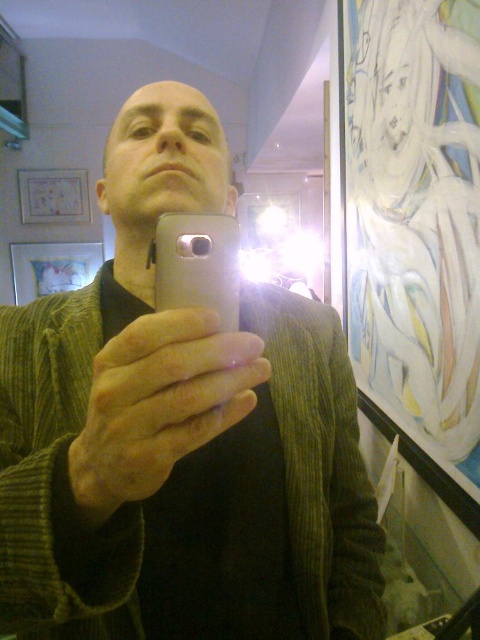
You are trying to take a clear selfie in the dimly lit room. You have two phones available, the matte silver phone at center and the silver metallic phone at center. Which phone should you choose to minimize glare from the bright light source?

The matte silver phone at center is located below the silver metallic phone at center. Since matte surfaces typically reflect less light and glare compared to shiny metallic surfaces, the matte silver phone at center would be better to minimize glare.

You are a photographer trying to capture a clear shot of the matte silver phone at center and the silver metallic phone at center in the scene. Since there is a glare from the bright light source, which phone might be more challenging to photograph due to its reflective surface?

The silver metallic phone at center has a more reflective surface compared to the matte silver phone at center, making it harder to photograph without glare.

You are trying to decide between two phones displayed in a gallery. You notice the matte silver phone at center and the silver metallic phone at center. Which one is taller?

The matte silver phone at center is taller than the silver metallic phone at center.